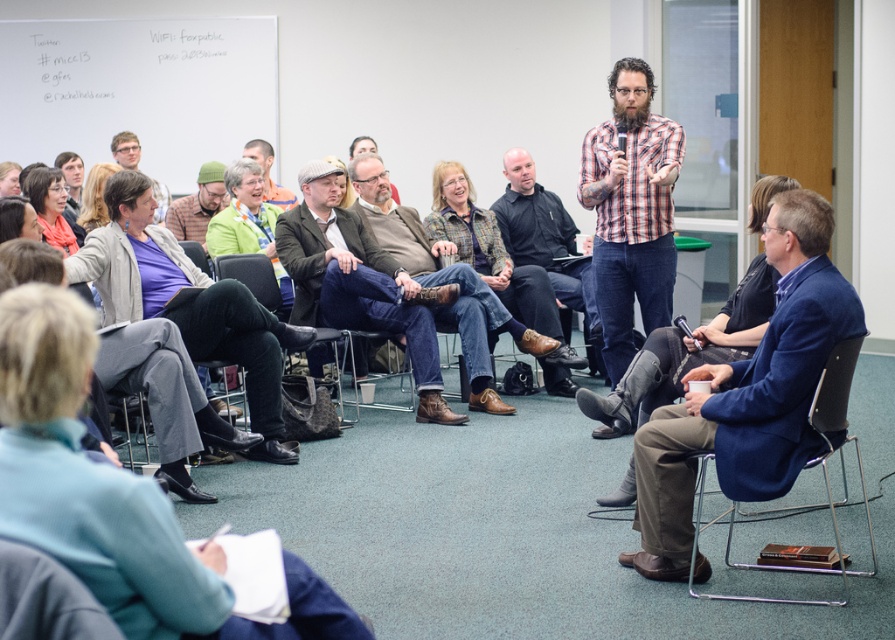
Is point (395, 330) positioned after point (114, 150)?

No, (395, 330) is closer to viewer.

Who is taller, leather boots at center or matte purple shirt at lower left?

leather boots at center is taller.

Find the location of `leather boots at center`. leather boots at center is located at coordinates (356, 282).

Based on the photo, is green knitted hat at center smaller than matte purple shirt at upper left?

Incorrect, green knitted hat at center is not smaller in size than matte purple shirt at upper left.

Can you confirm if green knitted hat at center is wider than matte purple shirt at upper left?

Yes.

Where is `green knitted hat at center`? green knitted hat at center is located at coordinates (249, 225).

This screenshot has height=640, width=895. Describe the element at coordinates (268, 173) in the screenshot. I see `green sweater at center` at that location.

Looking at this image, can you confirm if green sweater at center is bigger than matte purple shirt at upper left?

Yes.

Between point (274, 192) and point (69, 196), which one is positioned in front?

Point (69, 196)

The height and width of the screenshot is (640, 895). Find the location of `green sweater at center`. green sweater at center is located at coordinates (268, 173).